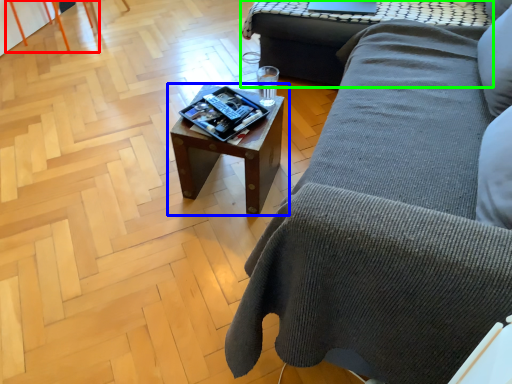
Question: Estimate the real-world distances between objects in this image. Which object is farther from chair (highlighted by a red box), table (highlighted by a blue box) or table (highlighted by a green box)?

Choices:
 (A) table
 (B) table

Answer: (A)